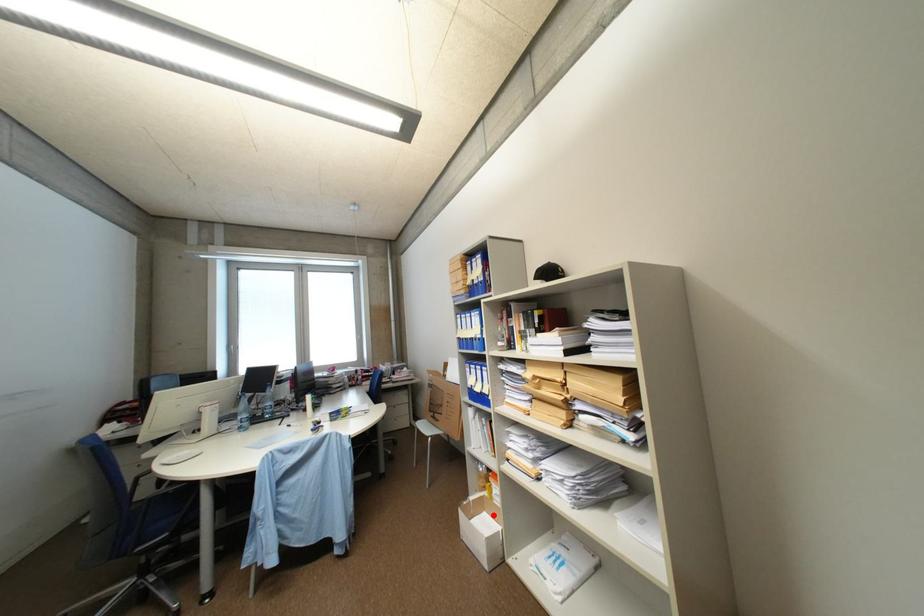
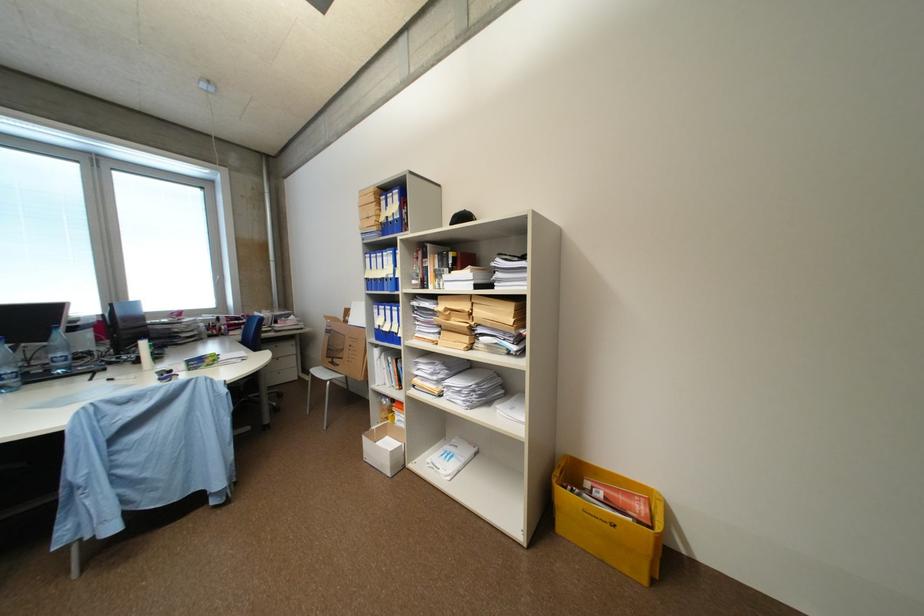
Find the pixel in the second image that matches the highlighted location in the first image.

(395, 439)